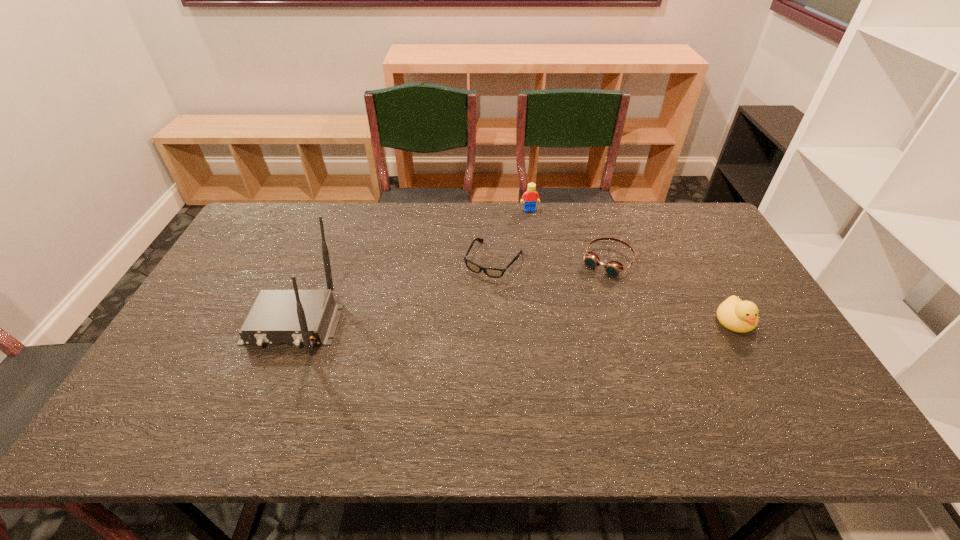
Identify the location of Lego located in the far edge section of the desktop. click(530, 195).

Locate an element on the screen. This screenshot has width=960, height=540. goggles present at the far edge is located at coordinates (613, 268).

Where is `object that is at the right edge`? object that is at the right edge is located at coordinates (734, 314).

In order to click on vacant space at the far edge in this screenshot , I will do `click(623, 237)`.

I want to click on vacant space at the near edge of the desktop, so click(536, 376).

The height and width of the screenshot is (540, 960). In the image, there is a desktop. Find the location of `vacant space at the left edge`. vacant space at the left edge is located at coordinates (187, 357).

You are a GUI agent. You are given a task and a screenshot of the screen. Output one action in this format:
    pyautogui.click(x=<x>, y=<y>)
    Task: Click on the vacant space at the right edge of the desktop
    The width and height of the screenshot is (960, 540).
    Given the screenshot: What is the action you would take?
    pyautogui.click(x=732, y=285)

In order to click on free space at the far left corner in this screenshot , I will do tap(296, 207).

You are a GUI agent. You are given a task and a screenshot of the screen. Output one action in this format:
    pyautogui.click(x=<x>, y=<y>)
    Task: Click on the vacant space at the near right corner of the desktop
    
    Given the screenshot: What is the action you would take?
    pyautogui.click(x=791, y=399)

Locate an element on the screen. Image resolution: width=960 pixels, height=540 pixels. free space between the fourth object from right to left and the leftmost object is located at coordinates (394, 292).